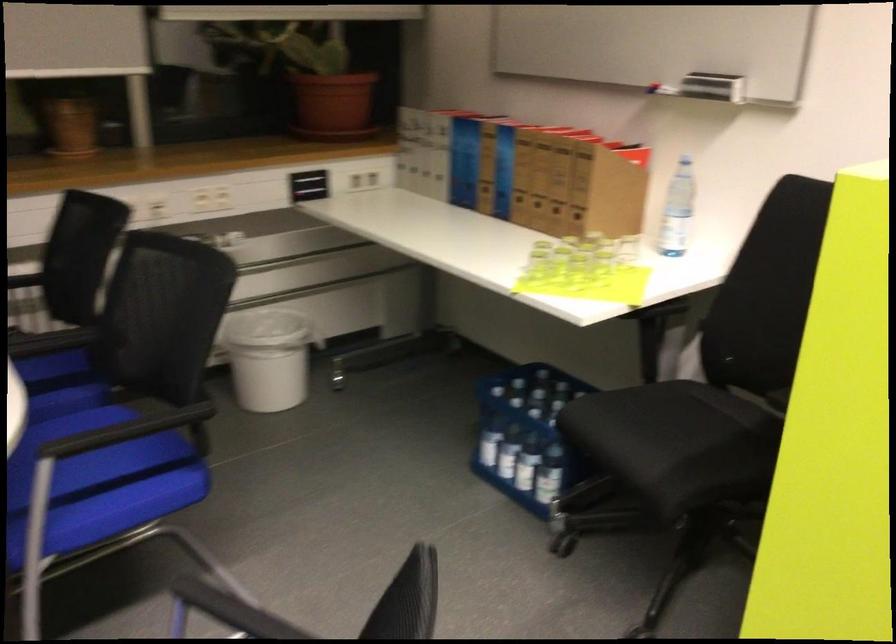
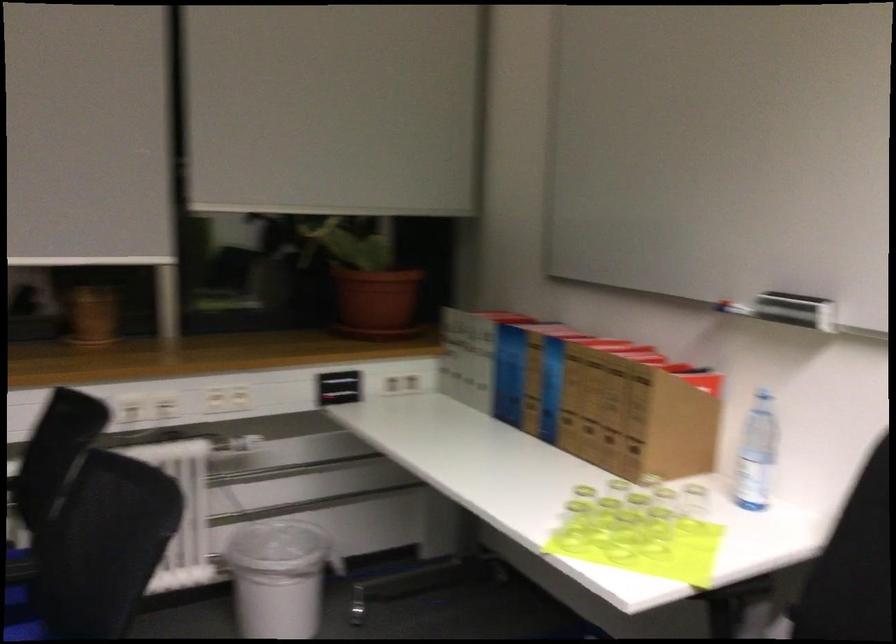
Locate, in the second image, the point that corresponds to point (536, 274) in the first image.

(573, 526)